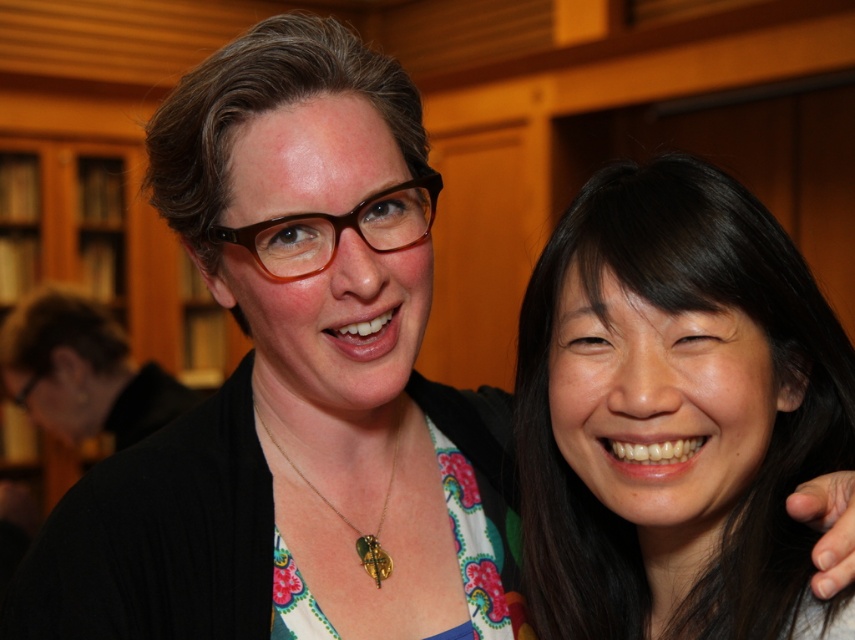
You are a photographer trying to capture a closeup shot of the gold metallic pendant at center without the black hair at right blocking it. Based on the scene, is this possible?

The black hair at right has a greater height compared to gold metallic pendant at center, so it might block the view of the pendant. Adjust the angle to lower the camera or have the subject move their hair aside.

You are standing in front of a photo of two people. There are two points marked in the image. The first point is at coordinate point (795, 312) and the second is at point (387, 499). Which point is closer to you?

Point (795, 312) is closer to the viewer than point (387, 499).